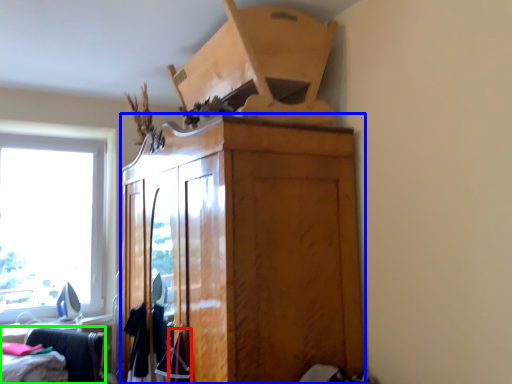
Question: Based on their relative distances, which object is farther from clothing (highlighted by a red box)? Choose from cabinetry (highlighted by a blue box) and furniture (highlighted by a green box).

Choices:
 (A) cabinetry
 (B) furniture

Answer: (B)